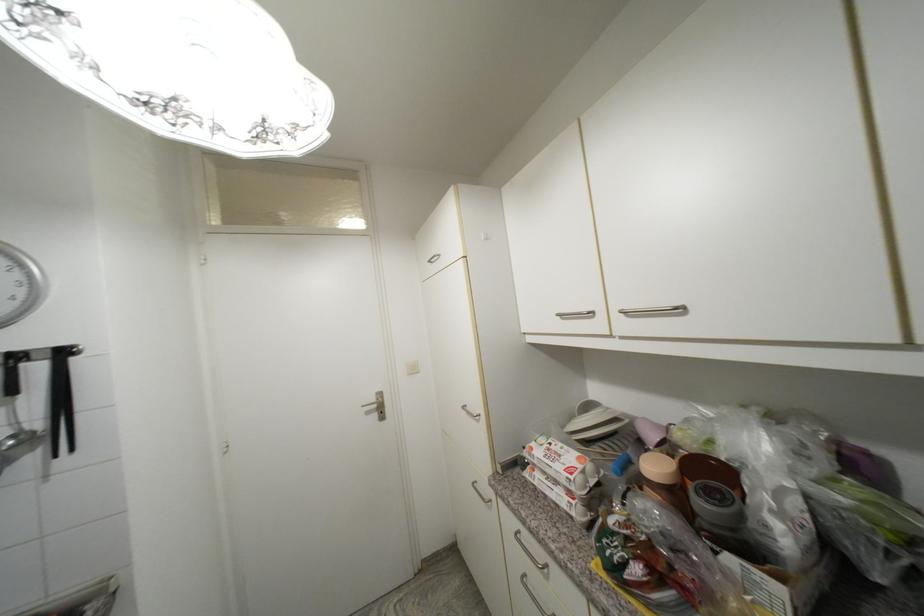
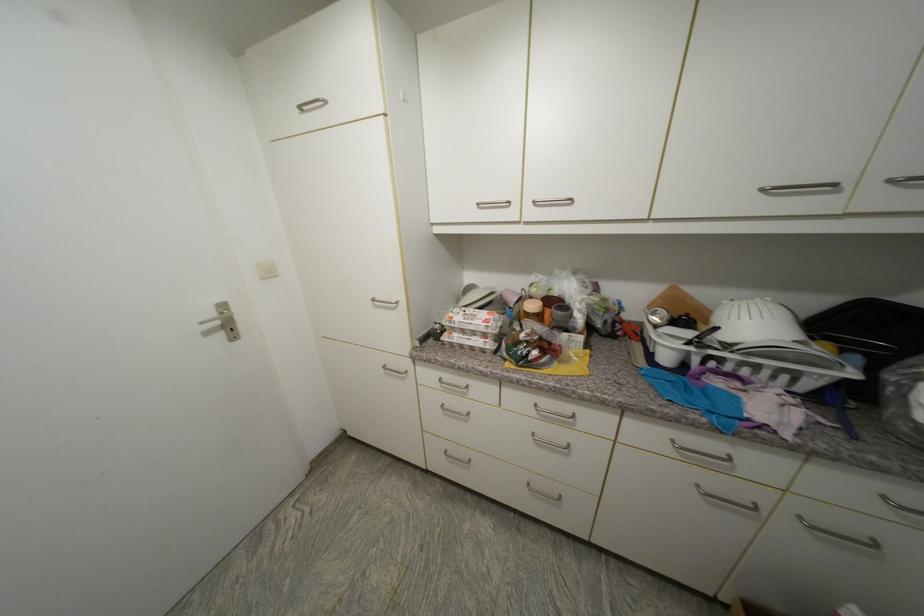
Locate, in the second image, the point that corresponds to point (469, 408) in the first image.

(379, 301)